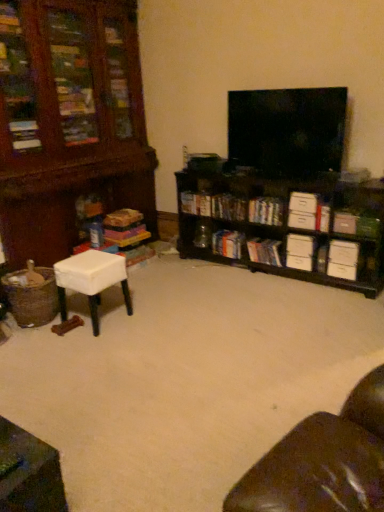
Where is `blank space situated above white cardboard box at center-right, which ranks as the fifth book in left-to-right order (from a real-world perspective)`? blank space situated above white cardboard box at center-right, which ranks as the fifth book in left-to-right order (from a real-world perspective) is located at coordinates (270, 201).